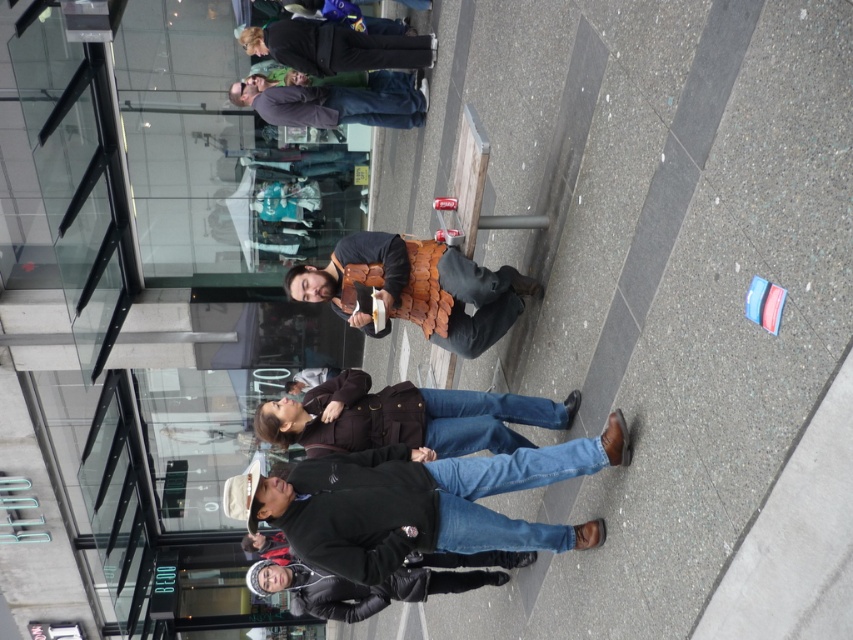
You are a fashion designer observing the street scene and want to create a new collection inspired by the clothing items. Which clothing item, the brown leather jacket at center or the brown leather vest at upper center, would you choose to feature in a larger size to match the trend of oversized designs?

The brown leather vest at upper center is larger in size compared to the brown leather jacket at center, so it would be the better choice to feature in a larger size for the oversized trend.

You are a photographer aiming to capture a candid shot of the black leather pants at upper center in the scene. Given their exact coordinates at point 0.075, 0.395, where should you position your camera to ensure they are centered in your frame?

To center the black leather pants at upper center at coordinates (335, 48) in your frame, position your camera so that the crosshairs align precisely with those coordinates.

You are a photographer standing in front of the scene. You want to take a photo of the dark brown leather jacket at lower center without the black leather jacket at lower center appearing in the background. Is it possible given their positions?

The dark brown leather jacket at lower center is closer to the viewer than the black leather jacket at lower center, so if you position yourself so that the black leather jacket is out of the frame or obscured by another object, it might be possible to capture the dark brown leather jacket without the black one in the background.